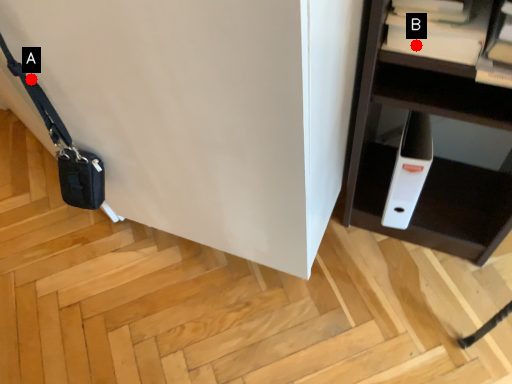
Question: Two points are circled on the image, labeled by A and B beside each circle. Which point is farther from the camera taking this photo?

Choices:
 (A) A is further
 (B) B is further

Answer: (A)